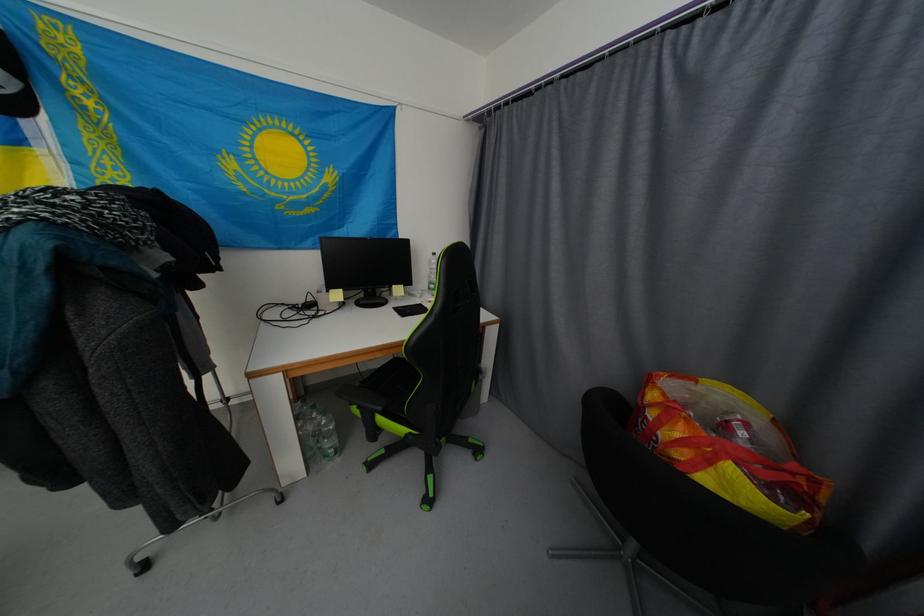
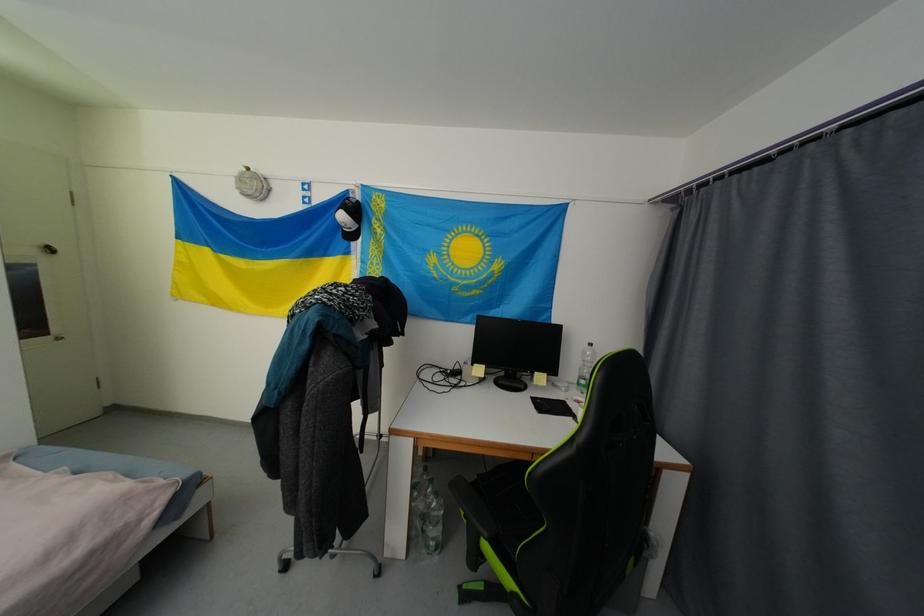
Question: The camera is either moving clockwise (left) or counter-clockwise (right) around the object. The first image is from the beginning of the video and the second image is from the end. Is the camera moving left or right when shooting the video?

Choices:
 (A) Left
 (B) Right

Answer: (B)